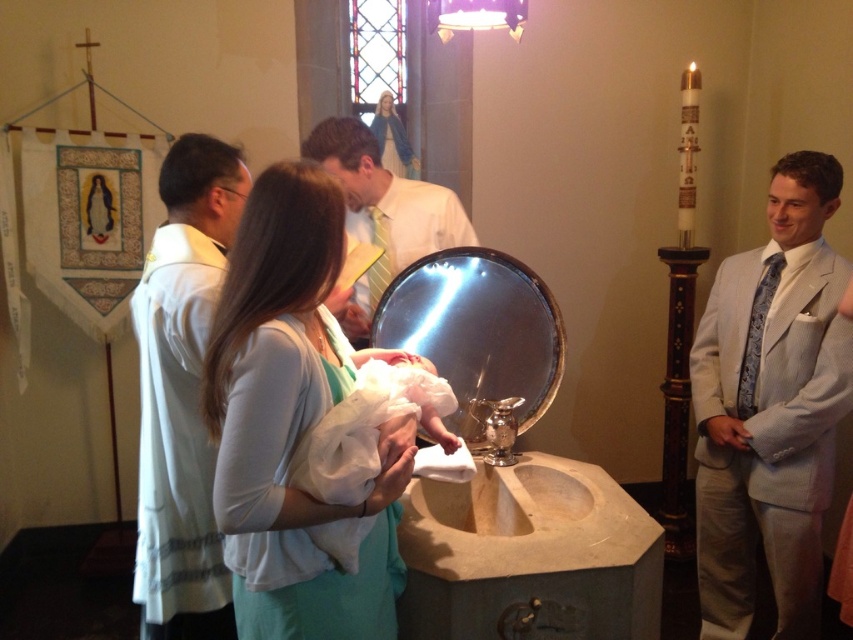
You are a photographer in a church. You see a white fabric baby at center and a white clothed baby at center. Which one is taller?

The white fabric baby at center is taller than the white clothed baby at center.

Looking at this image, you are a photographer in the church and you need to capture a clear image of the white fabric baby at center and the white silk shirt at center. Based on their positions, which one is closer to the camera?

The white fabric baby at center is closer to the camera because it is in front of the white silk shirt at center.